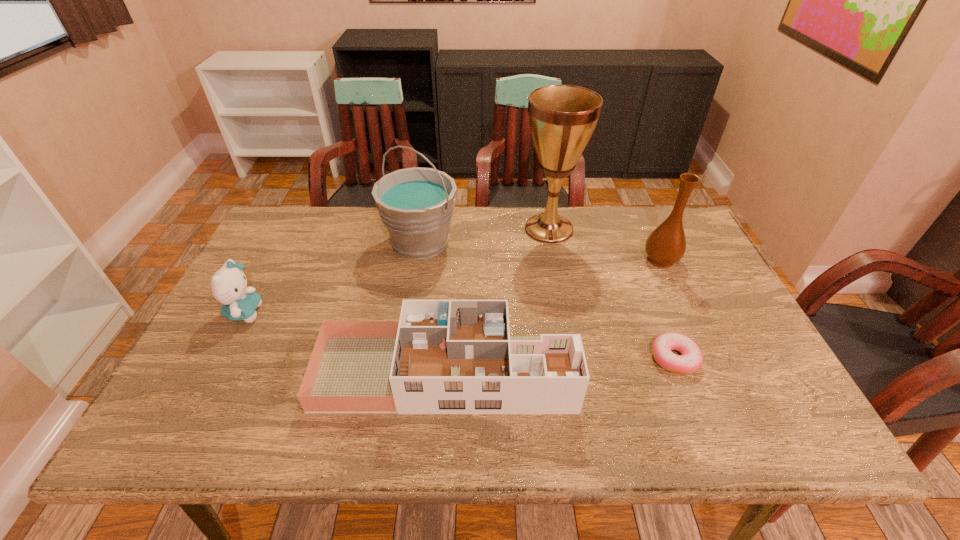
I want to click on unoccupied position between the bucket and the shortest object, so click(547, 300).

Find the location of `vacant area that lies between the bucket and the vase`. vacant area that lies between the bucket and the vase is located at coordinates (540, 251).

Locate an element on the screen. The height and width of the screenshot is (540, 960). empty space between the vase and the shortest object is located at coordinates (667, 309).

Locate which object is the fourth closest to the third nearest object. Please provide its 2D coordinates. Your answer should be formatted as a tuple, i.e. [(x, y)], where the tuple contains the x and y coordinates of a point satisfying the conditions above.

[(690, 360)]

Locate which object ranks fourth in proximity to the trophy cup. Please provide its 2D coordinates. Your answer should be formatted as a tuple, i.e. [(x, y)], where the tuple contains the x and y coordinates of a point satisfying the conditions above.

[(690, 360)]

You are a GUI agent. You are given a task and a screenshot of the screen. Output one action in this format:
    pyautogui.click(x=<x>, y=<y>)
    Task: Click on the free region that satisfies the following two spatial constraints: 1. on the front side of the trophy cup; 2. on the right side of the vase
    The width and height of the screenshot is (960, 540).
    Given the screenshot: What is the action you would take?
    pyautogui.click(x=555, y=260)

The image size is (960, 540). I want to click on vacant point that satisfies the following two spatial constraints: 1. on the front side of the trophy cup; 2. on the left side of the shortest object, so click(573, 358).

The width and height of the screenshot is (960, 540). Identify the location of vacant space that satisfies the following two spatial constraints: 1. on the back side of the bucket; 2. on the left side of the trophy cup. (423, 229).

You are a GUI agent. You are given a task and a screenshot of the screen. Output one action in this format:
    pyautogui.click(x=<x>, y=<y>)
    Task: Click on the vacant area in the image that satisfies the following two spatial constraints: 1. on the front side of the vase; 2. on the left side of the trophy cup
    
    Given the screenshot: What is the action you would take?
    [555, 260]